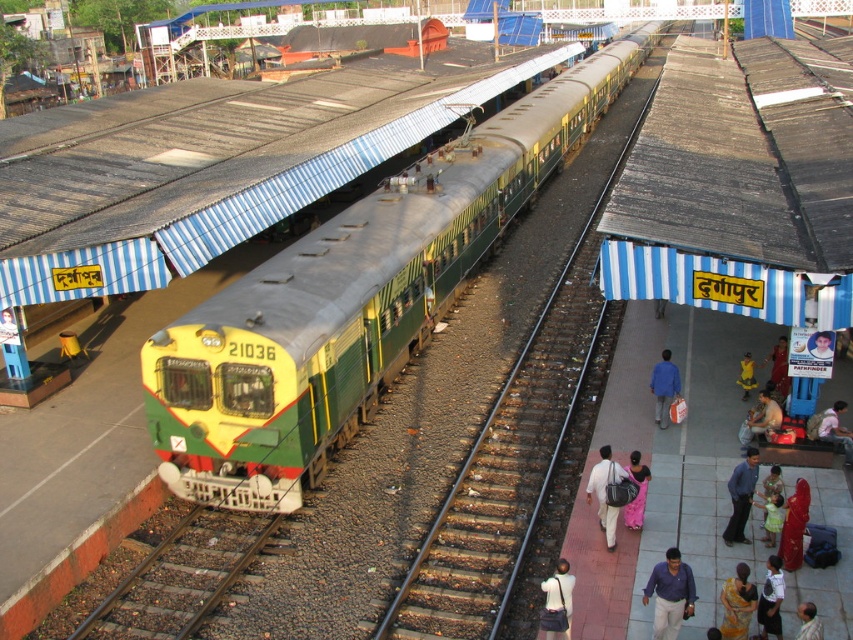
Question: Can you confirm if blue cotton shirt at center is wider than yellow fabric bag at center?

Choices:
 (A) yes
 (B) no

Answer: (B)

Question: Which point is farther to the camera?

Choices:
 (A) (637, 513)
 (B) (817, 332)
 (C) (619, 497)
 (D) (775, 355)

Answer: (D)

Question: Is the position of yellow sari at center more distant than that of smooth skin face at center?

Choices:
 (A) no
 (B) yes

Answer: (A)

Question: Which point is farther from the camera taking this photo?

Choices:
 (A) (802, 605)
 (B) (737, 540)
 (C) (775, 484)
 (D) (646, 481)

Answer: (B)

Question: Can you confirm if brown gravel train track at lower left is thinner than blue fabric bag at center?

Choices:
 (A) yes
 (B) no

Answer: (B)

Question: Which of these objects is positioned farthest from the dark blue fabric dress at lower right?

Choices:
 (A) green dress at center
 (B) blue fabric bag at center
 (C) blue cotton shirt at lower right

Answer: (B)